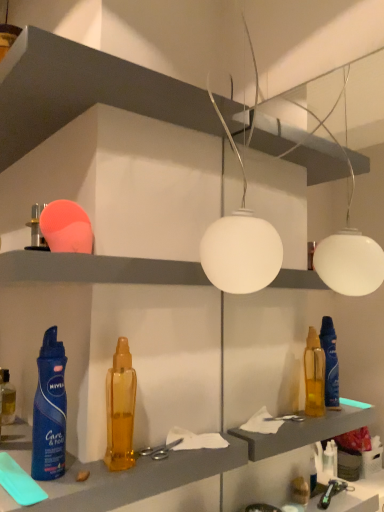
You are a GUI agent. You are given a task and a screenshot of the screen. Output one action in this format:
    pyautogui.click(x=<x>, y=<y>)
    Task: Click on the vacant space to the left of silver metallic scissors at center
    
    Given the screenshot: What is the action you would take?
    pyautogui.click(x=70, y=464)